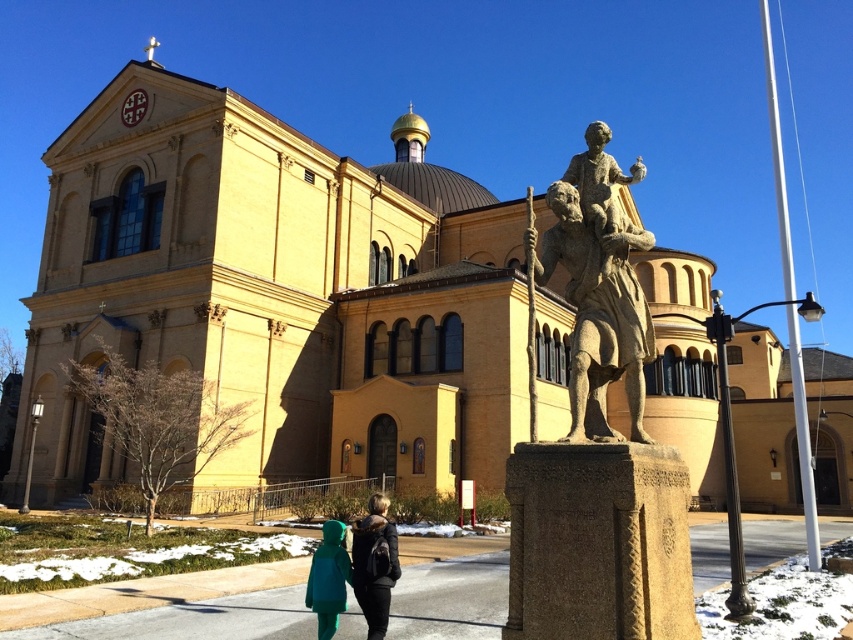
Which is above, stone statue at center or green matte jacket at lower center?

stone statue at center is higher up.

Does stone statue at center appear under green matte jacket at lower center?

Actually, stone statue at center is above green matte jacket at lower center.

Between point (621, 316) and point (323, 545), which one is positioned behind?

The point (323, 545) is more distant.

Identify the location of stone statue at center. This screenshot has width=853, height=640. (599, 285).

Does teal fabric coat at lower left have a greater width compared to green matte jacket at lower center?

Yes.

Does teal fabric coat at lower left appear on the left side of green matte jacket at lower center?

No, teal fabric coat at lower left is not to the left of green matte jacket at lower center.

Is point (387, 528) less distant than point (339, 570)?

No.

Locate an element on the screen. The width and height of the screenshot is (853, 640). teal fabric coat at lower left is located at coordinates (374, 564).

Who is positioned more to the left, stone statue at center or teal fabric coat at lower left?

teal fabric coat at lower left is more to the left.

Between stone statue at center and teal fabric coat at lower left, which one is positioned lower?

teal fabric coat at lower left is below.

Between point (570, 173) and point (355, 540), which one is positioned in front?

Positioned in front is point (570, 173).

You are a GUI agent. You are given a task and a screenshot of the screen. Output one action in this format:
    pyautogui.click(x=<x>, y=<y>)
    Task: Click on the stone statue at center
    The width and height of the screenshot is (853, 640).
    Given the screenshot: What is the action you would take?
    pyautogui.click(x=599, y=285)